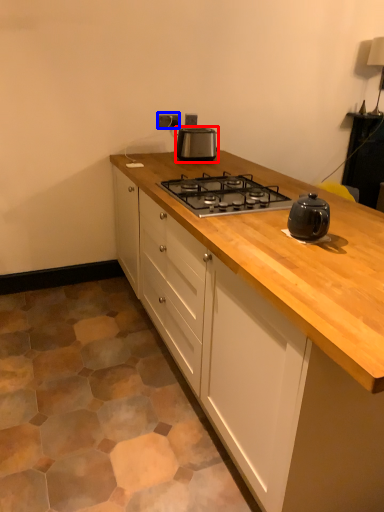
Question: Which object appears closest to the camera in this image, kitchen appliance (highlighted by a red box) or electric outlet (highlighted by a blue box)?

Choices:
 (A) kitchen appliance
 (B) electric outlet

Answer: (A)